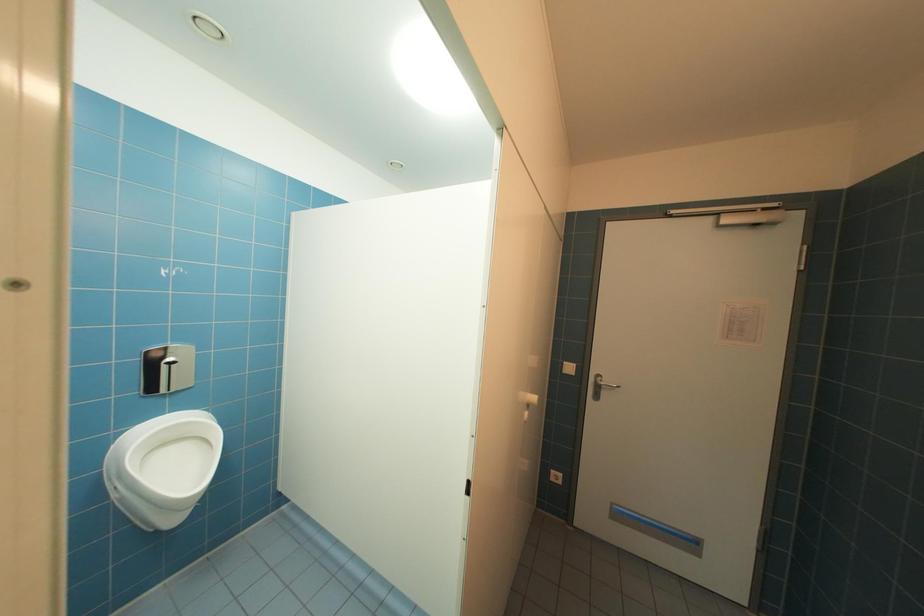
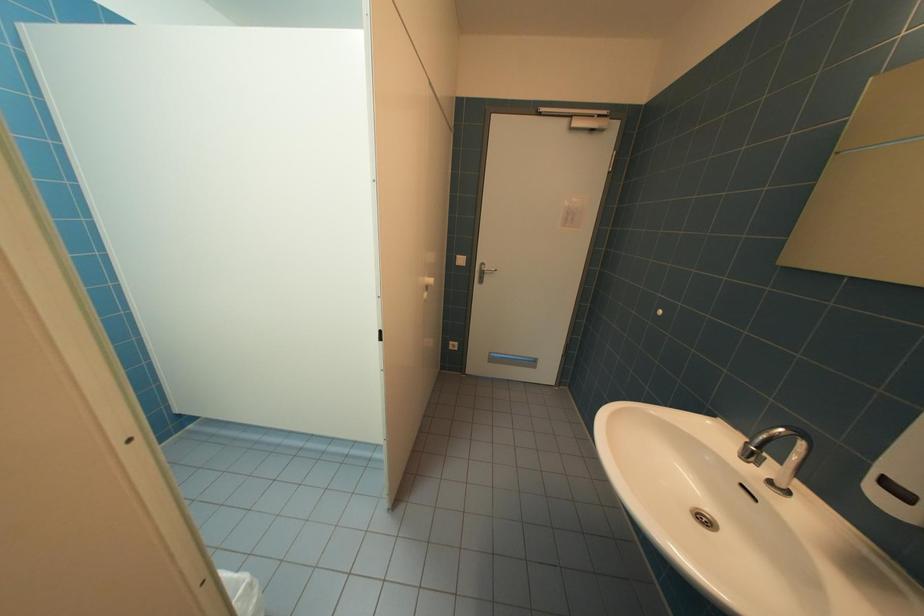
Question: What movement of the cameraman would produce the second image?

Choices:
 (A) Left
 (B) Right
 (C) Forward
 (D) Backward

Answer: (D)